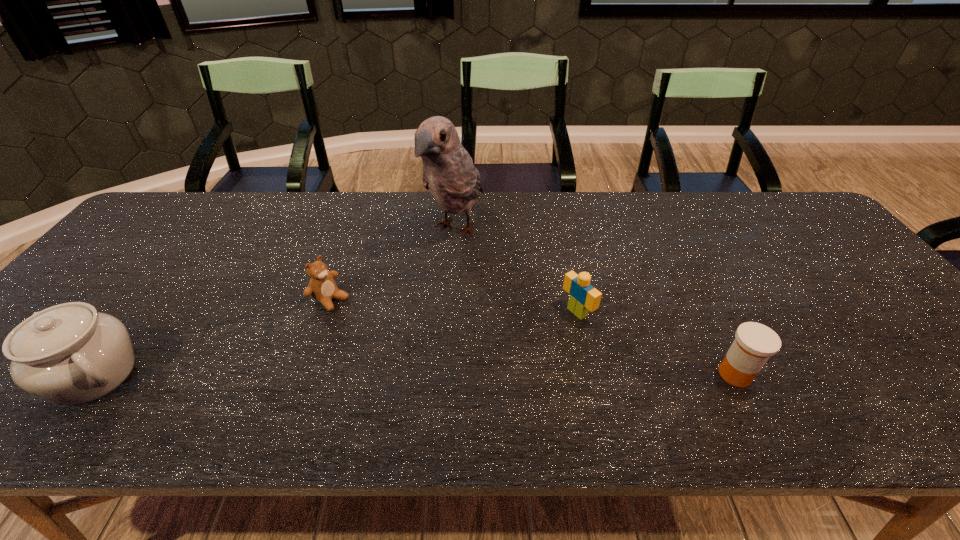
At what (x,y) coordinates should I click in order to perform the action: click on vacant space that satisfies the following two spatial constraints: 1. on the front side of the fourth object from right to left; 2. on the left side of the Lego. Please return your answer as a coordinate pair (x, y). The width and height of the screenshot is (960, 540). Looking at the image, I should click on (326, 312).